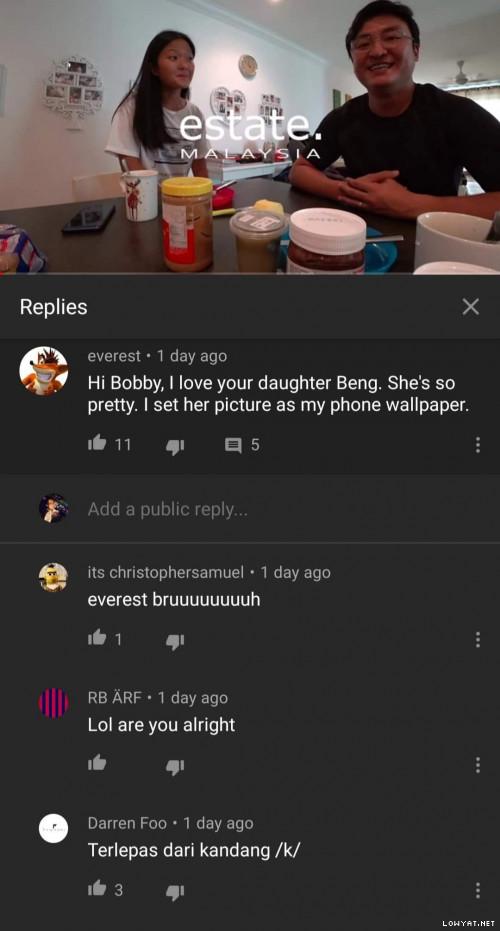
The image size is (500, 931). I want to click on wall, so click(x=307, y=49).